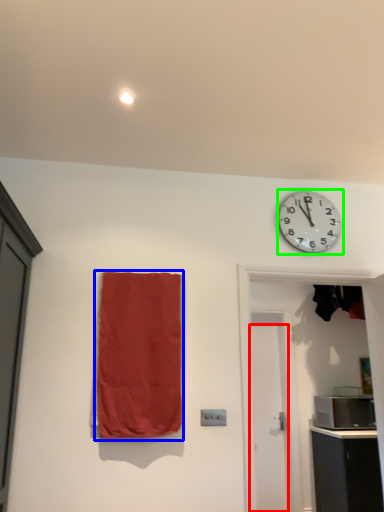
Question: Which object is positioned farthest from door (highlighted by a red box)? Select from curtain (highlighted by a blue box) and wall clock (highlighted by a green box).

Choices:
 (A) curtain
 (B) wall clock

Answer: (A)